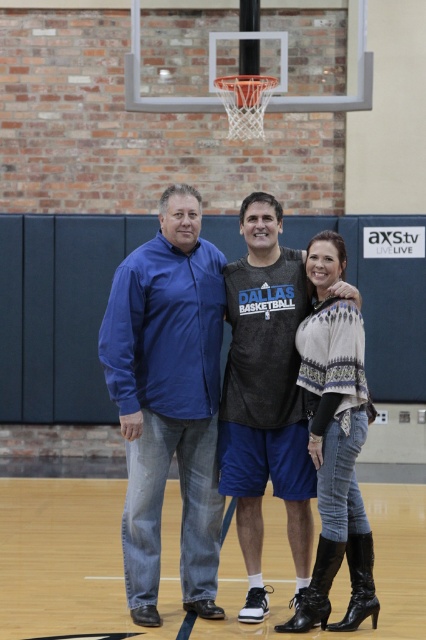
Describe the element at coordinates (265, 397) in the screenshot. I see `dark gray jersey at center` at that location.

Is dark gray jersey at center to the right of knit sweater at center from the viewer's perspective?

No, dark gray jersey at center is not to the right of knit sweater at center.

Looking at this image, who is more forward, [250,468] or [357,369]?

Positioned in front is point [357,369].

Where is `dark gray jersey at center`? This screenshot has height=640, width=426. dark gray jersey at center is located at coordinates (265, 397).

Is matte black jersey at center to the right of dark gray jersey at center from the viewer's perspective?

In fact, matte black jersey at center is to the left of dark gray jersey at center.

Does point (305, 442) lie in front of point (264, 216)?

Yes, it is.

This screenshot has width=426, height=640. Describe the element at coordinates (161, 371) in the screenshot. I see `matte black jersey at center` at that location.

Identify the location of matte black jersey at center. (161, 371).

In the scene shown: Measure the distance between matte black jersey at center and camera.

matte black jersey at center is 8.97 meters away from camera.

Is point (298, 300) behind point (362, 515)?

Yes, it is behind point (362, 515).

This screenshot has height=640, width=426. Identify the location of matte black jersey at center. (161, 371).

I want to click on matte black jersey at center, so [161, 371].